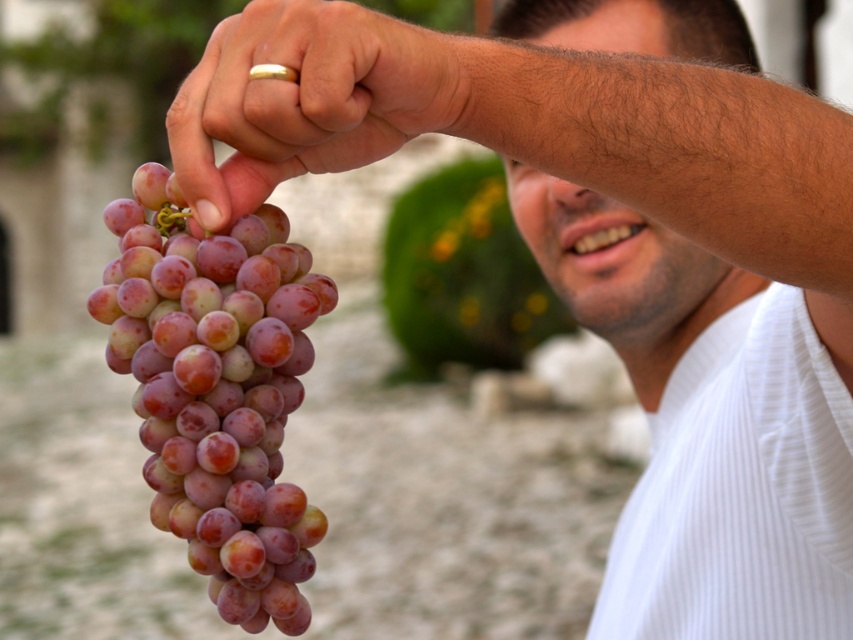
Between purple glossy grapes at left and matte gold ring at upper center, which one has less height?

Standing shorter between the two is matte gold ring at upper center.

Identify the location of purple glossy grapes at left. (218, 388).

Which is in front, point (119, 227) or point (184, 115)?

Point (184, 115) is in front.

The height and width of the screenshot is (640, 853). I want to click on purple glossy grapes at left, so (218, 388).